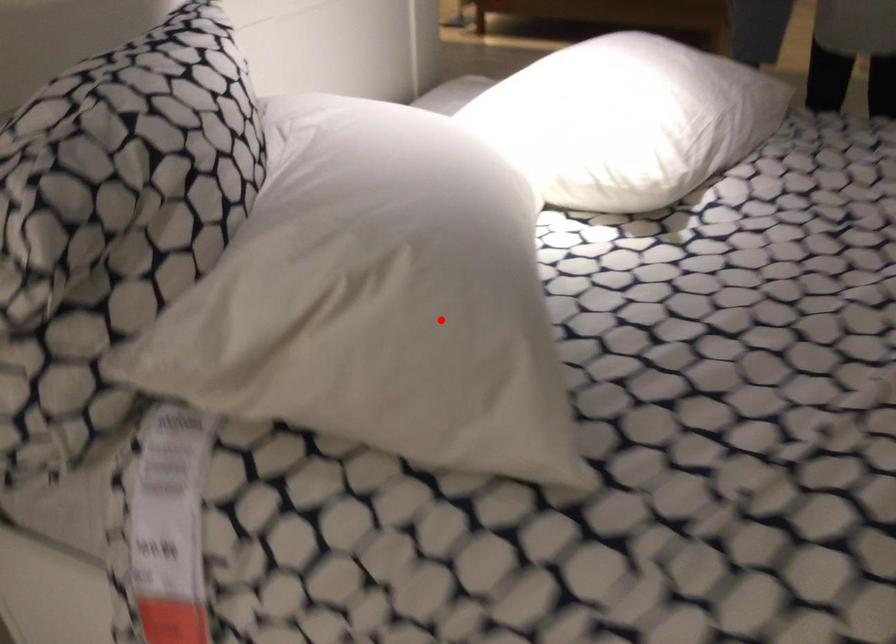
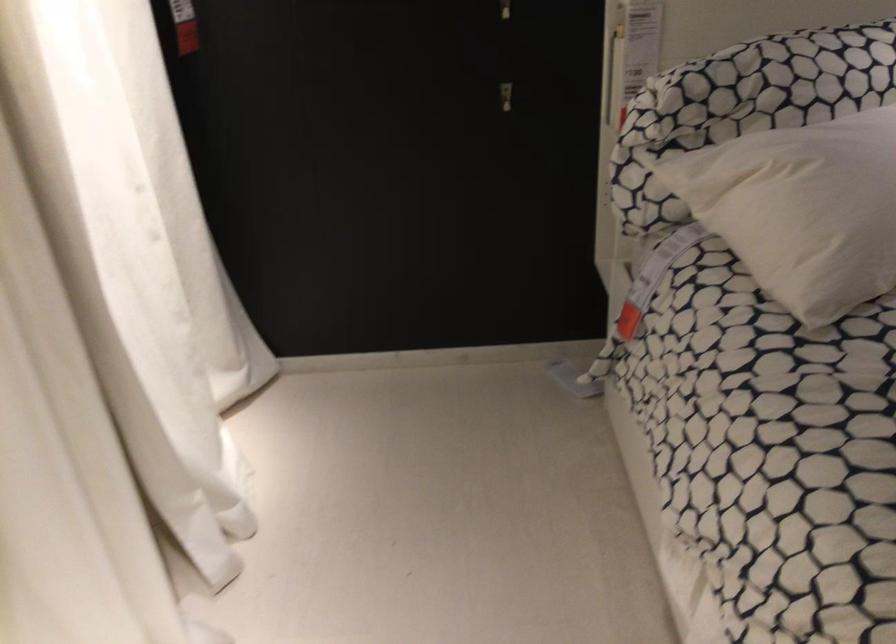
Question: I am providing you with two images of the same scene from different viewpoints. A red point is shown in image1. For the corresponding object point in image2, is it positioned nearer or farther from the camera?

Choices:
 (A) Nearer
 (B) Farther

Answer: (B)